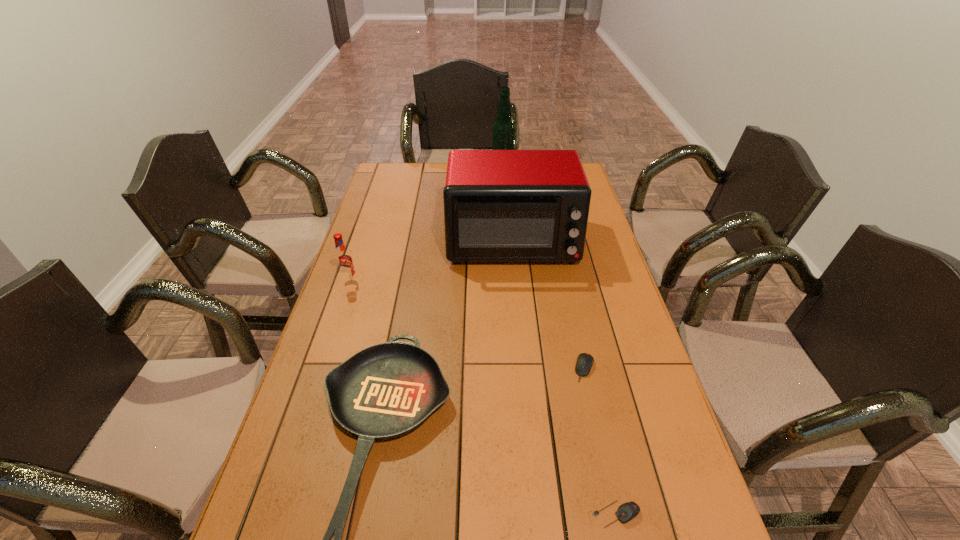
Where is `free space at the right edge`? This screenshot has height=540, width=960. free space at the right edge is located at coordinates (608, 256).

Where is `vacant position at the far left corner of the desktop`? vacant position at the far left corner of the desktop is located at coordinates click(x=393, y=181).

Image resolution: width=960 pixels, height=540 pixels. Find the location of `vacant region between the taller mouse and the alcohol`. vacant region between the taller mouse and the alcohol is located at coordinates pos(543,271).

Where is `vacant space in between the shortest object and the second farthest object`? Image resolution: width=960 pixels, height=540 pixels. vacant space in between the shortest object and the second farthest object is located at coordinates (564, 378).

I want to click on free space between the shortest object and the alcohol, so click(559, 344).

The height and width of the screenshot is (540, 960). I want to click on vacant space that's between the shorter mouse and the leftmost object, so click(x=483, y=398).

Locate an element on the screen. The width and height of the screenshot is (960, 540). free spot between the farther mouse and the farthest object is located at coordinates (543, 271).

Find the location of a particular element. The width and height of the screenshot is (960, 540). vacant space that is in between the taller mouse and the shortest object is located at coordinates (600, 441).

Find the location of a particular element. Image resolution: width=960 pixels, height=540 pixels. object that ranks as the second closest to the fourth nearest object is located at coordinates (499, 205).

Locate which object is the fourth closest to the toaster oven. Please provide its 2D coordinates. Your answer should be formatted as a tuple, i.e. [(x, y)], where the tuple contains the x and y coordinates of a point satisfying the conditions above.

[(585, 361)]